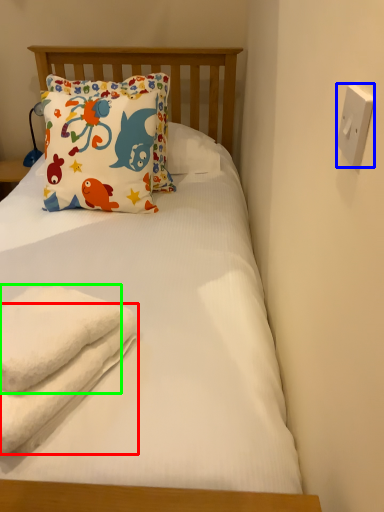
Question: Considering the real-world distances, which object is closest to beach towel (highlighted by a red box)? electric outlet (highlighted by a blue box) or towel (highlighted by a green box).

Choices:
 (A) electric outlet
 (B) towel

Answer: (B)